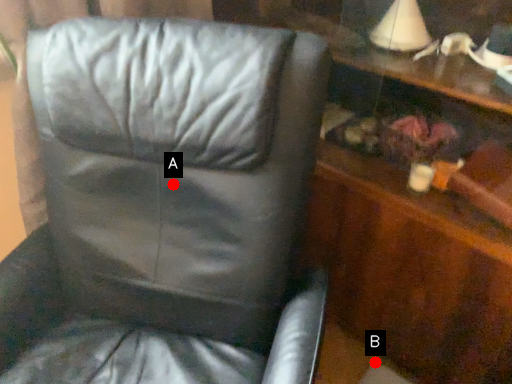
Question: Two points are circled on the image, labeled by A and B beside each circle. Which point appears closest to the camera in this image?

Choices:
 (A) A is closer
 (B) B is closer

Answer: (A)